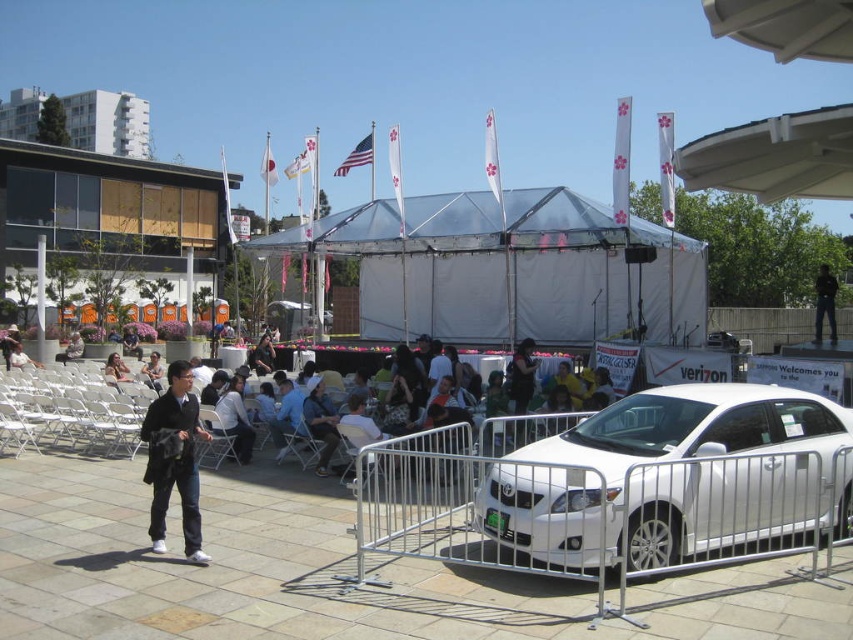
Question: Which is nearer to the transparent fabric tent at center?

Choices:
 (A) black leather jacket at lower left
 (B) dark blue fabric dress at center

Answer: (B)

Question: From the image, what is the correct spatial relationship of black matte jacket at lower left in relation to light blue shirt at center?

Choices:
 (A) below
 (B) above

Answer: (A)

Question: Which object appears farthest from the camera in this image?

Choices:
 (A) transparent fabric tent at center
 (B) dark gray suit at center

Answer: (B)

Question: Is dark blue fabric dress at center wider than white cotton shirt at lower left?

Choices:
 (A) yes
 (B) no

Answer: (B)

Question: Which point is closer to the camera?

Choices:
 (A) white glossy sedan at center
 (B) black leather pants at right

Answer: (A)

Question: Can you confirm if light blue shirt at center is thinner than black leather jacket at lower left?

Choices:
 (A) no
 (B) yes

Answer: (A)